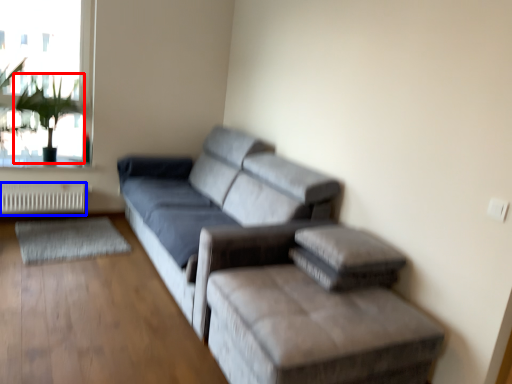
Question: Which object appears farthest to the camera in this image, plant (highlighted by a red box) or radiator (highlighted by a blue box)?

Choices:
 (A) plant
 (B) radiator

Answer: (B)